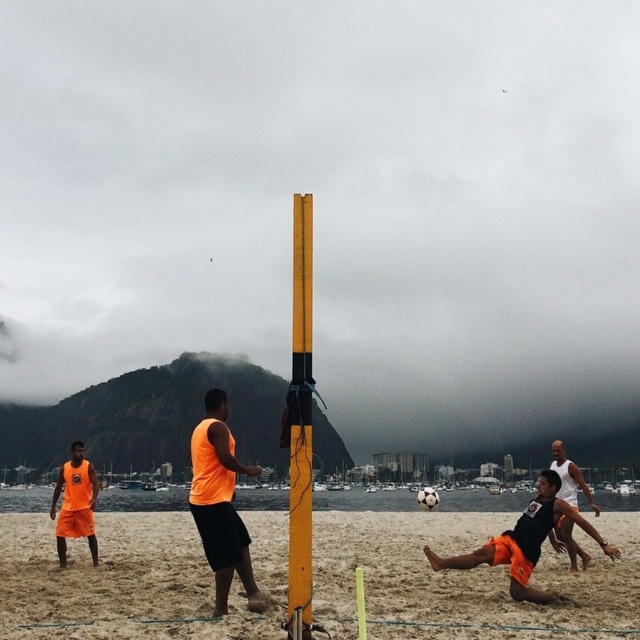
You are a photographer standing at the edge of the beach volleyball court. You want to take a photo that includes both the orange fabric shirt at center and the black matte soccer player at center. Which object should you focus on first if you want to capture the taller one in the foreground?

The orange fabric shirt at center is much taller than the black matte soccer player at center, so you should focus on the orange fabric shirt at center first to capture the taller one in the foreground.

You are a drone operator tasked with capturing aerial footage of the volleyball game. The sandy beach at center is crucial for the shot. Given the coordinates provided, can you confirm if the point at (464, 580) aligns with the sandy beach at center?

Yes, the point at (464, 580) marks the sandy beach at center according to the provided coordinates.